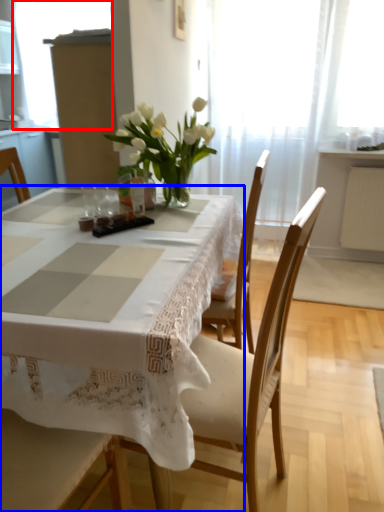
Question: Which object appears closest to the camera in this image, window screen (highlighted by a red box) or table (highlighted by a blue box)?

Choices:
 (A) window screen
 (B) table

Answer: (B)